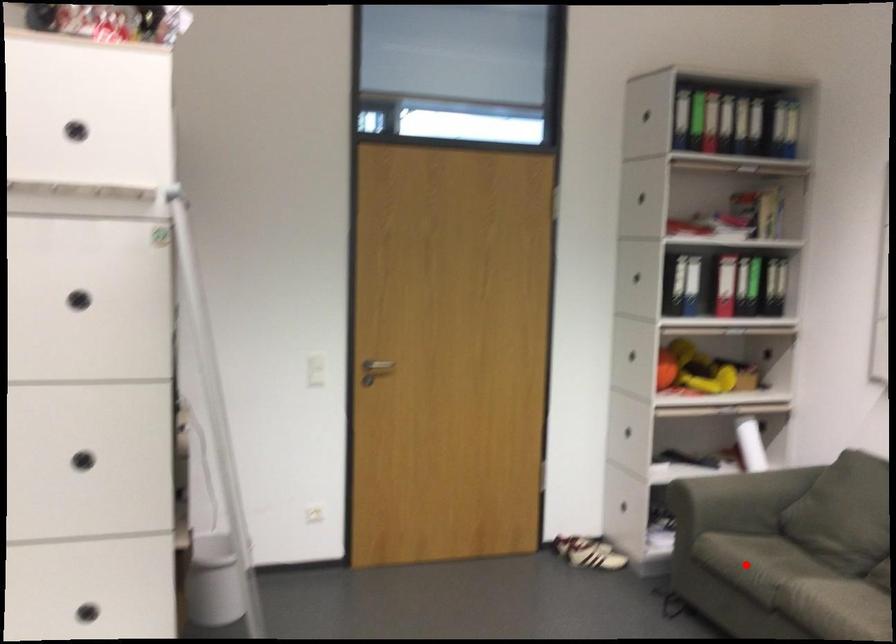
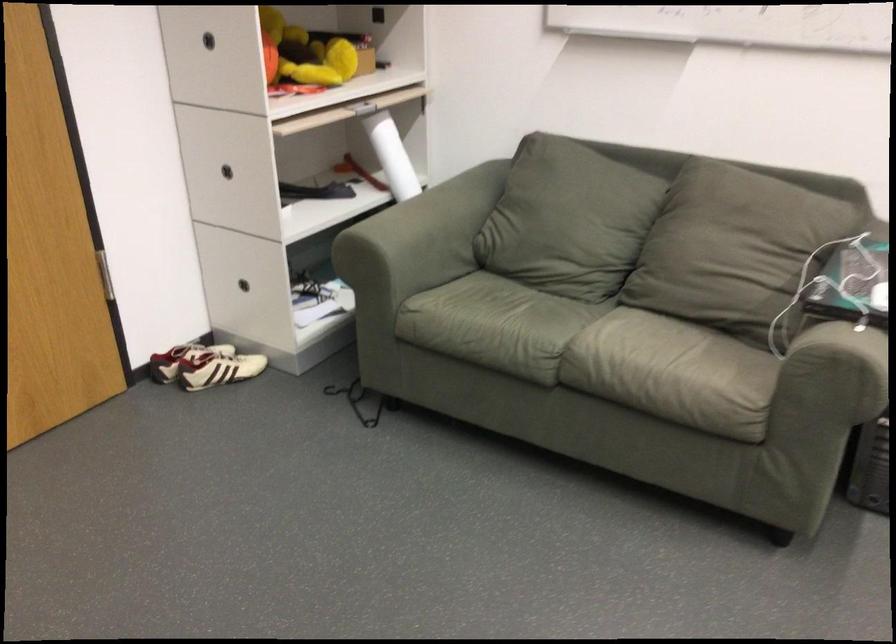
Question: I am providing you with two images of the same scene from different viewpoints. In image1, a red point is highlighted. Considering the same 3D point in image2, which of the following is correct?

Choices:
 (A) It is closer
 (B) It is farther

Answer: (A)